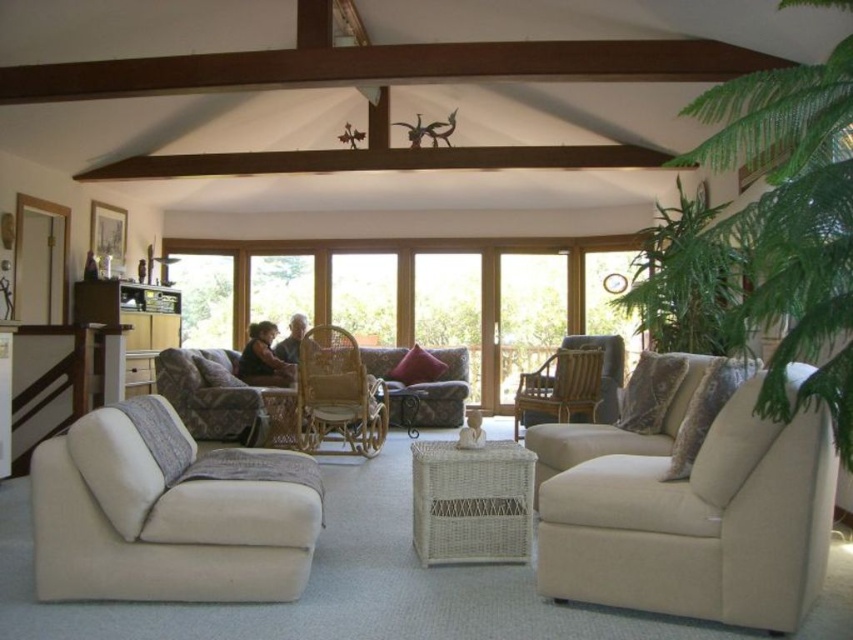
Between beige fabric couch at lower right and beige fabric couch at lower left, which one is positioned lower?

beige fabric couch at lower right

Which of these two, beige fabric couch at lower right or beige fabric couch at lower left, stands shorter?

beige fabric couch at lower left is shorter.

Measure the distance between beige fabric couch at lower right and camera.

They are 6.68 feet apart.

At what (x,y) coordinates should I click in order to perform the action: click on beige fabric couch at lower right. Please return your answer as a coordinate pair (x, y). Image resolution: width=853 pixels, height=640 pixels. Looking at the image, I should click on (689, 516).

Is point (570, 342) farther from viewer compared to point (645, 340)?

No, it is in front of (645, 340).

Is point (607, 394) positioned after point (631, 262)?

That is False.

The height and width of the screenshot is (640, 853). Find the location of `light brown woven armchair at center`. light brown woven armchair at center is located at coordinates (572, 384).

Is point (546, 340) in front of point (51, 470)?

No, it is not.

Who is more forward, (291,278) or (292,520)?

Point (292,520) is more forward.

Where is `clear glass windows at center`? The image size is (853, 640). clear glass windows at center is located at coordinates (426, 296).